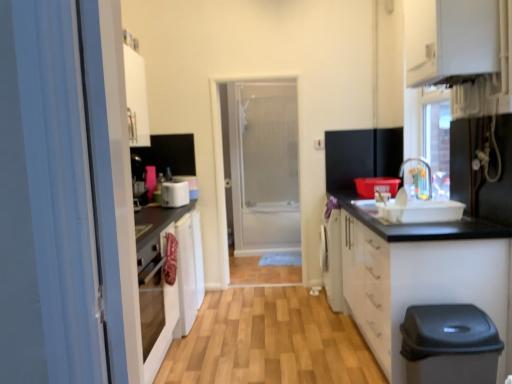
Question: Considering the relative positions of metallic silver faucet at upper right, which is the first appliance in front-to-back order, and wooden floor at center in the image provided, is metallic silver faucet at upper right, which is the first appliance in front-to-back order, to the left of wooden floor at center from the viewer's perspective?

Choices:
 (A) yes
 (B) no

Answer: (B)

Question: Does metallic silver faucet at upper right, marked as the first appliance in a right-to-left arrangement, have a lesser height compared to wooden floor at center?

Choices:
 (A) yes
 (B) no

Answer: (B)

Question: Is wooden floor at center completely or partially inside metallic silver faucet at upper right, which ranks as the second appliance in back-to-front order?

Choices:
 (A) no
 (B) yes

Answer: (A)

Question: Is the position of metallic silver faucet at upper right, which is the second appliance from left to right, less distant than that of wooden floor at center?

Choices:
 (A) yes
 (B) no

Answer: (A)

Question: Is the depth of metallic silver faucet at upper right, which ranks as the second appliance in back-to-front order, greater than that of wooden floor at center?

Choices:
 (A) yes
 (B) no

Answer: (B)

Question: Is metallic silver faucet at upper right, marked as the first appliance in a right-to-left arrangement, taller than wooden floor at center?

Choices:
 (A) yes
 (B) no

Answer: (A)

Question: From a real-world perspective, is white plastic toaster at center, which is counted as the first appliance, starting from the back, physically below transparent glass door at center?

Choices:
 (A) yes
 (B) no

Answer: (A)

Question: From the image's perspective, is white plastic toaster at center, which is counted as the first appliance, starting from the back, under transparent glass door at center?

Choices:
 (A) yes
 (B) no

Answer: (A)

Question: Is white plastic toaster at center, which is counted as the first appliance, starting from the back, positioned far away from transparent glass door at center?

Choices:
 (A) no
 (B) yes

Answer: (B)

Question: Does white plastic toaster at center, the first appliance positioned from the left, have a smaller size compared to transparent glass door at center?

Choices:
 (A) no
 (B) yes

Answer: (B)

Question: Is the position of white plastic toaster at center, the first appliance positioned from the left, less distant than that of transparent glass door at center?

Choices:
 (A) no
 (B) yes

Answer: (B)

Question: Is white plastic toaster at center, which is counted as the first appliance, starting from the back, aimed at transparent glass door at center?

Choices:
 (A) yes
 (B) no

Answer: (B)

Question: Is white glossy cabinet at lower right, the first cabinetry ordered from the bottom, placed right next to transparent glass door at center?

Choices:
 (A) no
 (B) yes

Answer: (A)